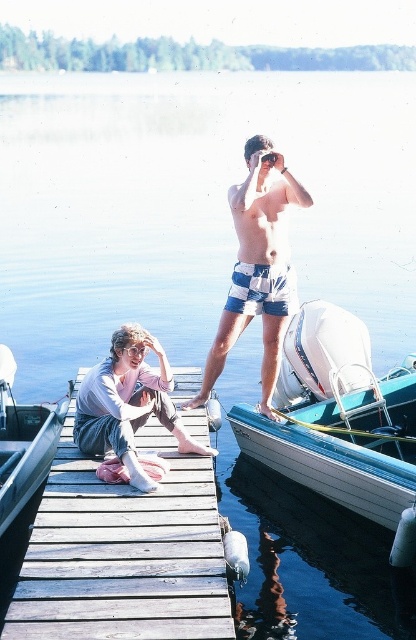
Question: Which point is closer to the camera?

Choices:
 (A) wooden at center
 (B) denim pants at center

Answer: (A)

Question: Estimate the real-world distances between objects in this image. Which object is closer to the striped swim trunks at center?

Choices:
 (A) clear plastic goggles at center
 (B) wooden at center
 (C) denim pants at center
 (D) metallic gray boat at left

Answer: (C)

Question: Is white glossy boat at center positioned behind denim pants at center?

Choices:
 (A) yes
 (B) no

Answer: (B)

Question: Which of the following is the farthest from the observer?

Choices:
 (A) (175, 419)
 (B) (203, 417)
 (C) (395, 512)

Answer: (B)

Question: Does wooden at center have a lesser width compared to striped swim trunks at center?

Choices:
 (A) yes
 (B) no

Answer: (B)

Question: Can you confirm if wooden at center is bigger than striped swim trunks at center?

Choices:
 (A) yes
 (B) no

Answer: (A)